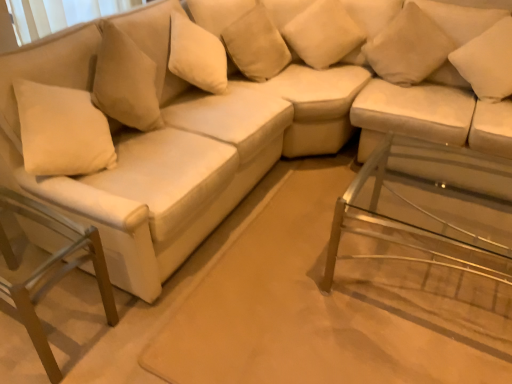
Question: From a real-world perspective, is beige fabric pillow at upper center, which appears as the 3th pillow when viewed from the right, positioned above or below white soft cushion at upper right, arranged as the 1th pillow when viewed from the right?

Choices:
 (A) below
 (B) above

Answer: (B)

Question: In the image, is beige fabric pillow at upper center, which appears as the 3th pillow when viewed from the right, positioned in front of or behind white soft cushion at upper right, which appears as the fourth pillow when viewed from the left?

Choices:
 (A) front
 (B) behind

Answer: (B)

Question: Estimate the real-world distances between objects in this image. Which object is closer to the suede-like beige pillow at upper center, placed as the 4th pillow when sorted from right to left?

Choices:
 (A) beige fabric pillow at upper right, acting as the second pillow starting from the right
 (B) white soft cushion at upper right, arranged as the 1th pillow when viewed from the right
 (C) metallic silver swivel chair at lower left
 (D) clear glass side table at lower right
 (E) beige fabric pillow at upper center, which appears as the 3th pillow when viewed from the right

Answer: (E)

Question: Estimate the real-world distances between objects in this image. Which object is farther from the beige fabric pillow at upper center, which ranks as the 2th pillow in left-to-right order?

Choices:
 (A) metallic silver swivel chair at lower left
 (B) suede-like beige pillow at upper center, placed as the 4th pillow when sorted from right to left
 (C) beige fabric pillow at upper right, placed as the third pillow when sorted from left to right
 (D) white soft cushion at upper right, which appears as the fourth pillow when viewed from the left
 (E) clear glass side table at lower right

Answer: (A)